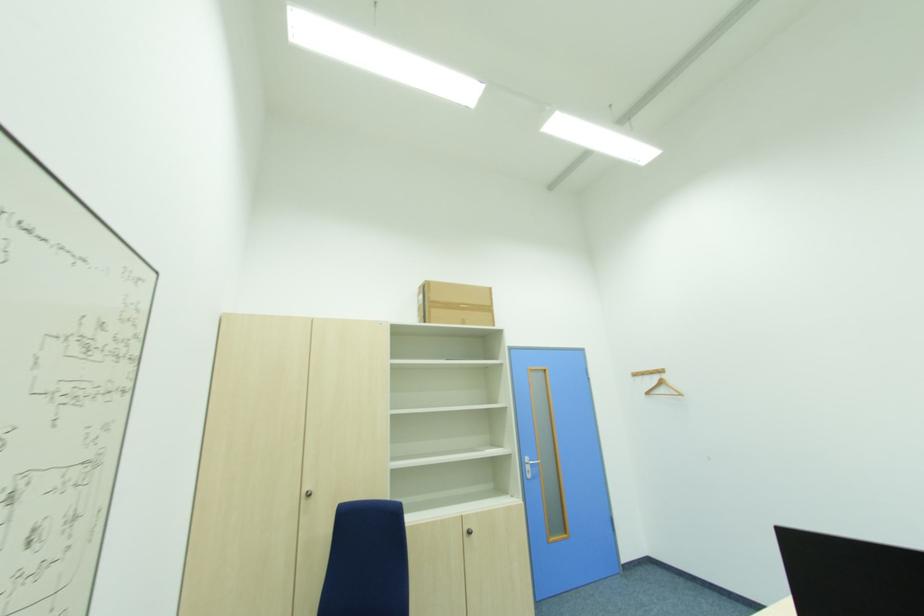
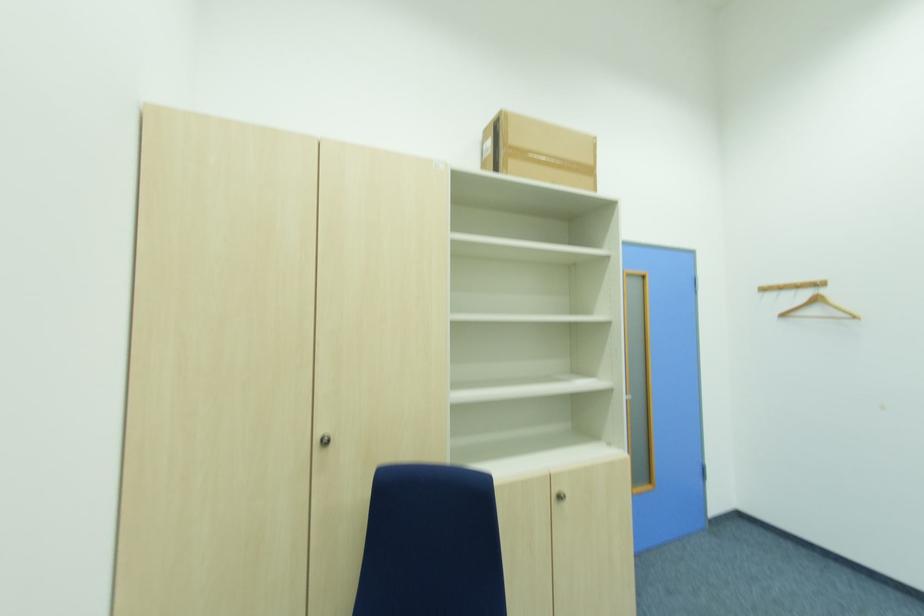
Locate, in the second image, the point that corresponds to pixel 472 536 in the first image.

(564, 499)